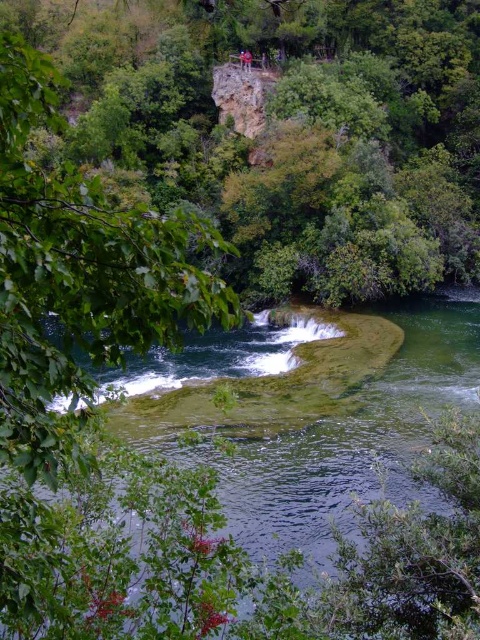
Question: Which point appears farthest from the camera in this image?

Choices:
 (A) (330, 602)
 (B) (241, 60)

Answer: (B)

Question: Is clear water at center behind blue fabric person at upper center?

Choices:
 (A) no
 (B) yes

Answer: (A)

Question: Is clear water at center below blue fabric person at upper center?

Choices:
 (A) no
 (B) yes

Answer: (B)

Question: Which of the following is the closest to the observer?

Choices:
 (A) clear water at center
 (B) blue fabric person at upper center

Answer: (A)

Question: Is clear water at center in front of blue fabric person at upper center?

Choices:
 (A) no
 (B) yes

Answer: (B)